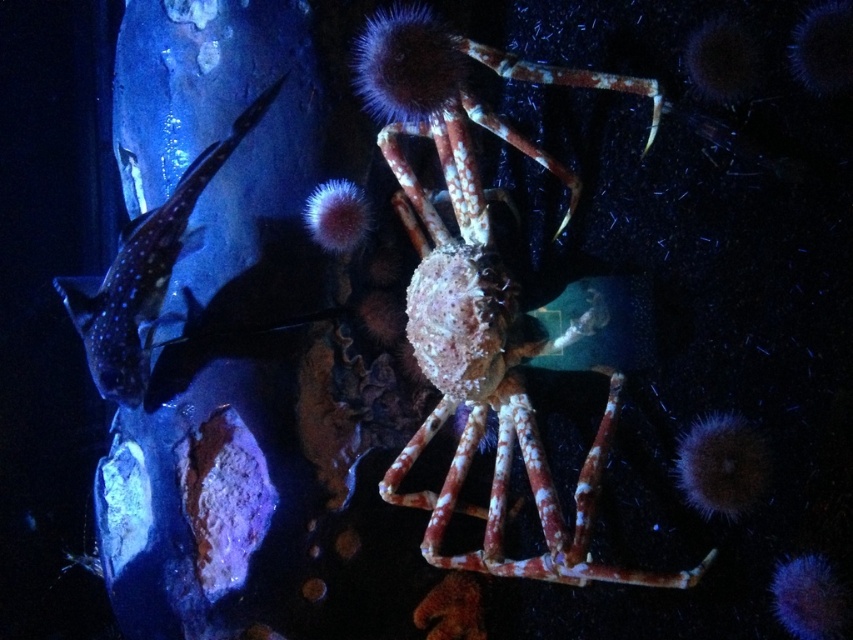
Question: Is speckled orange crab at center closer to camera compared to shiny blue fish at left?

Choices:
 (A) yes
 (B) no

Answer: (A)

Question: Which object appears farthest from the camera in this image?

Choices:
 (A) speckled orange crab at center
 (B) shiny blue fish at left

Answer: (B)

Question: Is speckled orange crab at center to the left of shiny blue fish at left from the viewer's perspective?

Choices:
 (A) no
 (B) yes

Answer: (A)

Question: Does speckled orange crab at center have a greater width compared to shiny blue fish at left?

Choices:
 (A) no
 (B) yes

Answer: (B)